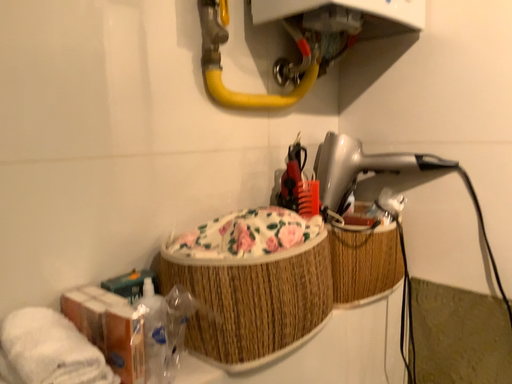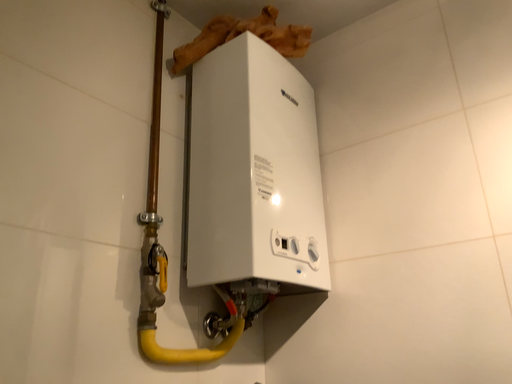
Question: How did the camera likely rotate when shooting the video?

Choices:
 (A) rotated left
 (B) rotated right

Answer: (B)